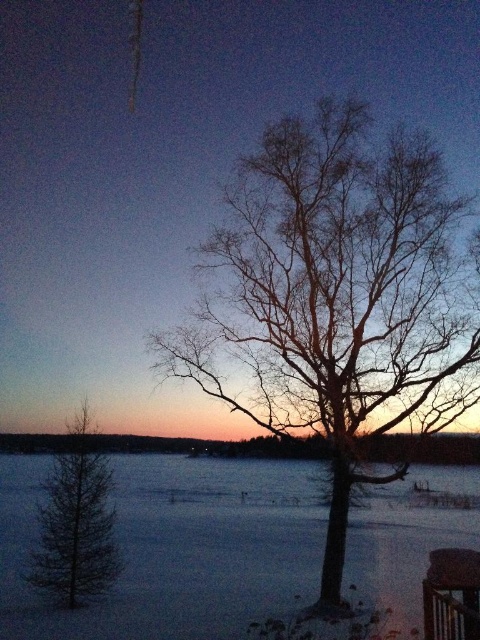
Question: Where is bare branches at center located in relation to dark green coniferous tree at lower left in the image?

Choices:
 (A) above
 (B) below

Answer: (A)

Question: Is snowy white water at lower left behind dark green coniferous tree at lower left?

Choices:
 (A) no
 (B) yes

Answer: (A)

Question: Which of the following is the closest to the observer?

Choices:
 (A) (284, 173)
 (B) (60, 522)
 (C) (7, 561)

Answer: (B)

Question: Which of the following is the farthest from the observer?

Choices:
 (A) dark green coniferous tree at lower left
 (B) snowy white water at lower left
 (C) bare branches at center

Answer: (A)

Question: Among these objects, which one is nearest to the camera?

Choices:
 (A) dark green coniferous tree at lower left
 (B) bare branches at center

Answer: (B)

Question: Is bare branches at center above snowy white water at lower left?

Choices:
 (A) no
 (B) yes

Answer: (B)